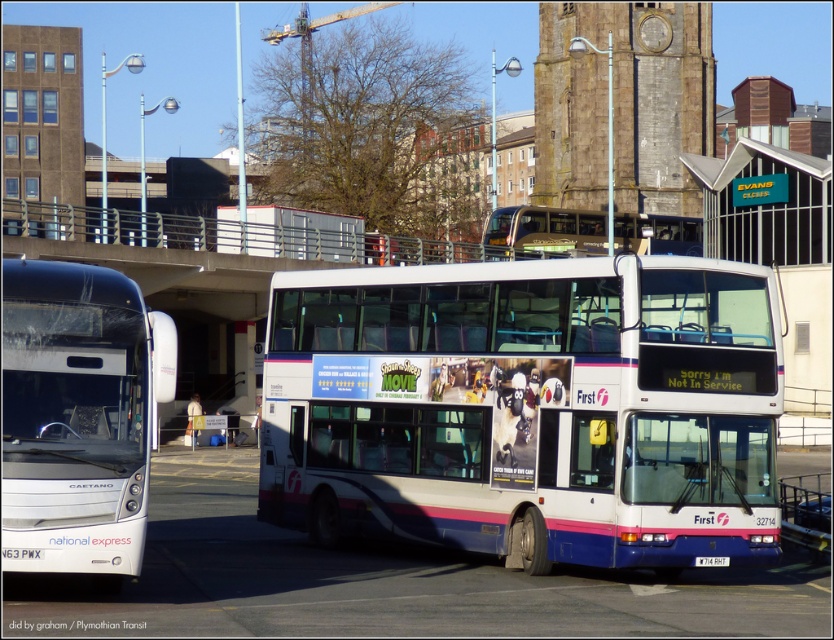
Describe the element at coordinates (78, 417) in the screenshot. The image size is (834, 640). I see `white matte bus at left` at that location.

Does point (144, 461) lie behind point (629, 224)?

No, (144, 461) is in front of (629, 224).

Find the location of a particular element. white matte bus at left is located at coordinates (78, 417).

Between point (621, 476) and point (19, 566), which one is positioned behind?

The point (621, 476) is more distant.

Between point (559, 378) and point (16, 481), which one is positioned behind?

Point (559, 378)

The width and height of the screenshot is (834, 640). I want to click on white plastic bus at center, so click(528, 410).

Does point (641, 444) lie behind point (551, 216)?

That is False.

Does white plastic bus at center come behind gold metallic bus at center?

No, white plastic bus at center is in front of gold metallic bus at center.

Does point (338, 381) come behind point (691, 220)?

No, (338, 381) is in front of (691, 220).

The image size is (834, 640). Identify the location of white plastic bus at center. tap(528, 410).